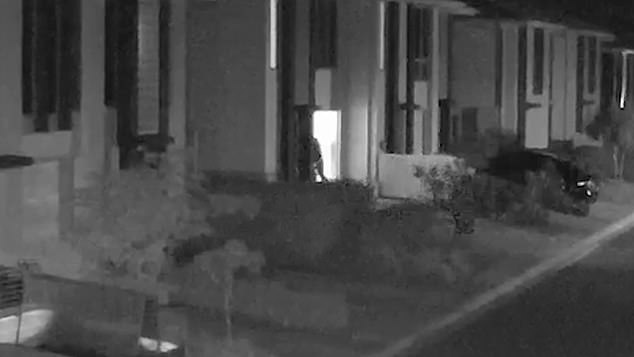
The width and height of the screenshot is (634, 357). What are the coordinates of `windows` in the screenshot? It's located at (423, 39), (536, 66), (592, 74), (327, 43), (75, 62).